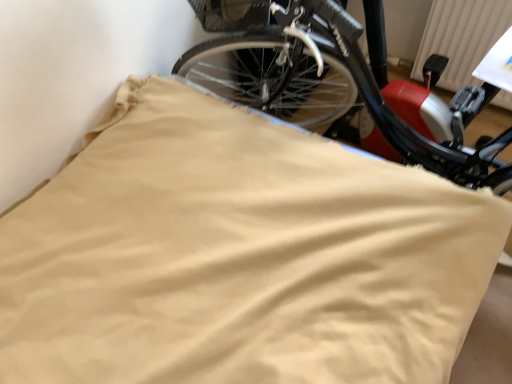
Measure the distance between matte black bicycle at upper center and camera.

matte black bicycle at upper center and camera are 79.53 centimeters apart from each other.

The height and width of the screenshot is (384, 512). Describe the element at coordinates (327, 81) in the screenshot. I see `matte black bicycle at upper center` at that location.

At what (x,y) coordinates should I click in order to perform the action: click on matte black bicycle at upper center. Please return your answer as a coordinate pair (x, y). Looking at the image, I should click on (327, 81).

Image resolution: width=512 pixels, height=384 pixels. Identify the location of matte black bicycle at upper center. (327, 81).